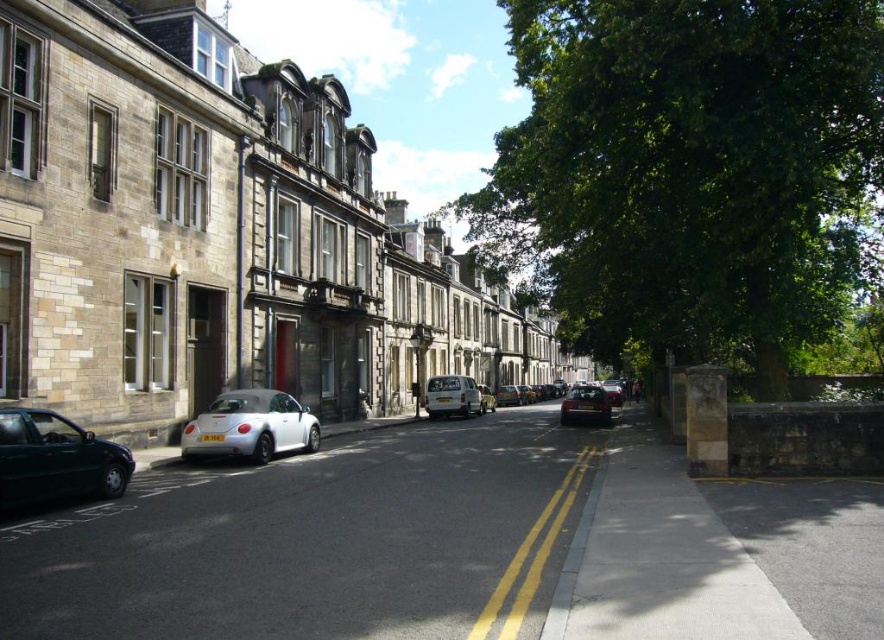
Question: Based on their relative distances, which object is nearer to the matte silver car at center?

Choices:
 (A) silver metallic van at center
 (B) yellow painted lines at center

Answer: (A)

Question: In this image, where is shiny dark green car at lower left located relative to matte silver car at center?

Choices:
 (A) left
 (B) right

Answer: (A)

Question: Which point is farther from the camera taking this photo?

Choices:
 (A) pos(80,483)
 (B) pos(768,77)
 (C) pos(290,403)
 (D) pos(531,584)

Answer: (C)

Question: Can you confirm if green leafy tree at right is positioned to the left of yellow painted lines at center?

Choices:
 (A) yes
 (B) no

Answer: (B)

Question: Is matte silver car at center to the left of white matte car at center from the viewer's perspective?

Choices:
 (A) yes
 (B) no

Answer: (B)

Question: Which is nearer to the white matte convertible at center?

Choices:
 (A) white matte car at center
 (B) shiny black car at center
 (C) shiny dark green car at lower left

Answer: (C)